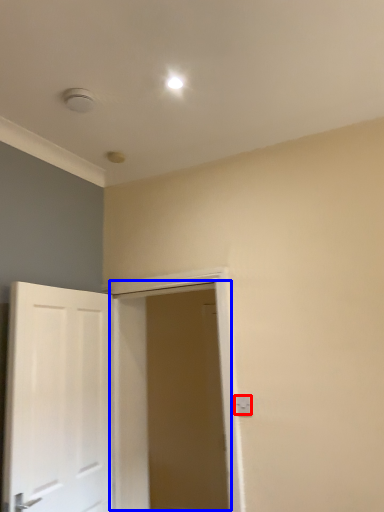
Question: Which point is further to the camera, electric outlet (highlighted by a red box) or door (highlighted by a blue box)?

Choices:
 (A) electric outlet
 (B) door

Answer: (A)